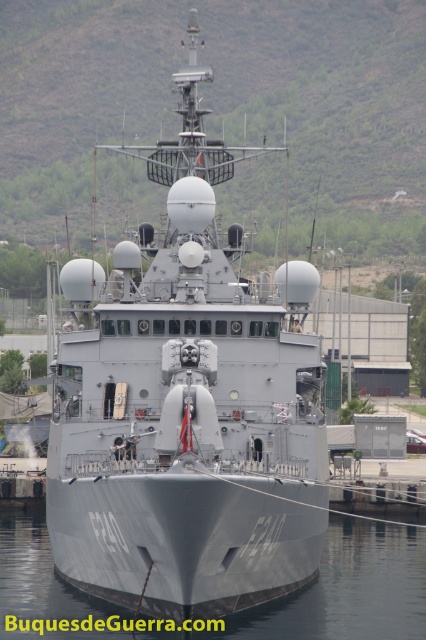
You are a naval architect evaluating the design of the gray metallic ship at center and the gray metallic water at center. Which object occupies a greater area in the image?

The gray metallic ship at center is larger in size than the gray metallic water at center, so it occupies a greater area in the image.

You are standing on the dock next to the gray metallic ship at center. You want to throw a small floating device into the water. Which direction should you aim to ensure it lands in the gray metallic water at center?

The gray metallic ship at center is located above the gray metallic water at center, so you should aim downward towards the water below the ship to ensure the device lands in the gray metallic water at center.